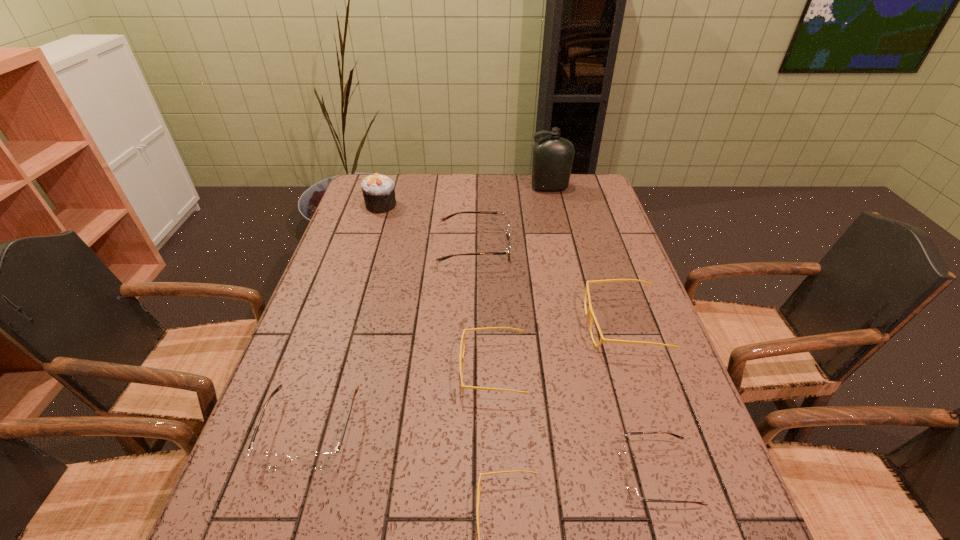
The height and width of the screenshot is (540, 960). What are the coordinates of `the smallest brown spectacles` in the screenshot? It's located at (631, 487).

Identify the location of vacant space situated 0.300m on the front of the bottle. This screenshot has width=960, height=540. (563, 244).

This screenshot has width=960, height=540. Find the location of `free spot located on the front of the second tallest object`. free spot located on the front of the second tallest object is located at coordinates (373, 229).

Where is `vacant region located 0.290m on the front-facing side of the biggest brown spectacles`? vacant region located 0.290m on the front-facing side of the biggest brown spectacles is located at coordinates (604, 248).

I want to click on free region located in front of the lenses of the rightmost beige spectacles, so click(x=461, y=325).

Image resolution: width=960 pixels, height=540 pixels. Find the location of `vacant space situated 0.380m in front of the lenses of the rightmost beige spectacles`. vacant space situated 0.380m in front of the lenses of the rightmost beige spectacles is located at coordinates (438, 325).

Identify the location of vacant space located 0.360m in front of the lenses of the rightmost beige spectacles. (445, 325).

At what (x,y) coordinates should I click in order to perform the action: click on vacant space located on the front-facing side of the leftmost brown spectacles. Please return your answer as a coordinate pair (x, y). Image resolution: width=960 pixels, height=540 pixels. Looking at the image, I should click on (283, 517).

This screenshot has width=960, height=540. What are the coordinates of `vacant space located 0.320m in front of the lenses of the second biggest beige spectacles` in the screenshot? It's located at (323, 369).

Find the location of `vacant space located 0.150m in front of the lenses of the second biggest beige spectacles`. vacant space located 0.150m in front of the lenses of the second biggest beige spectacles is located at coordinates (396, 369).